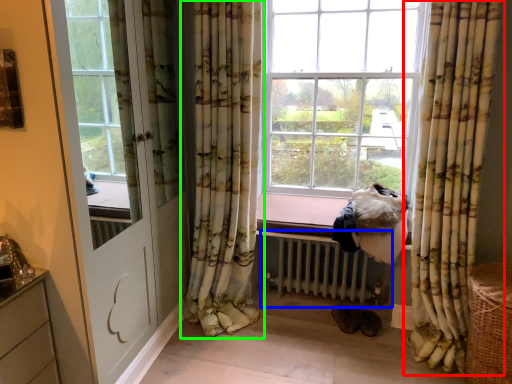
Question: Considering the real-world distances, which object is closest to curtain (highlighted by a red box)? radiator (highlighted by a blue box) or curtain (highlighted by a green box).

Choices:
 (A) radiator
 (B) curtain

Answer: (A)